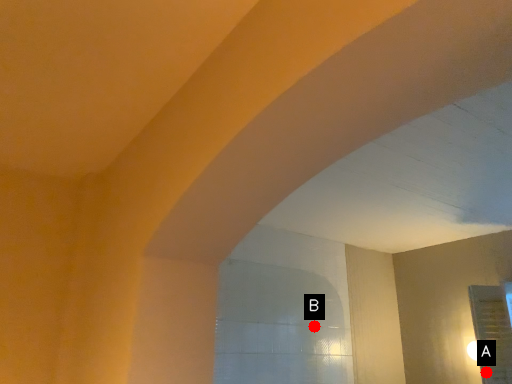
Question: Two points are circled on the image, labeled by A and B beside each circle. Among these points, which one is nearest to the camera?

Choices:
 (A) A is closer
 (B) B is closer

Answer: (A)